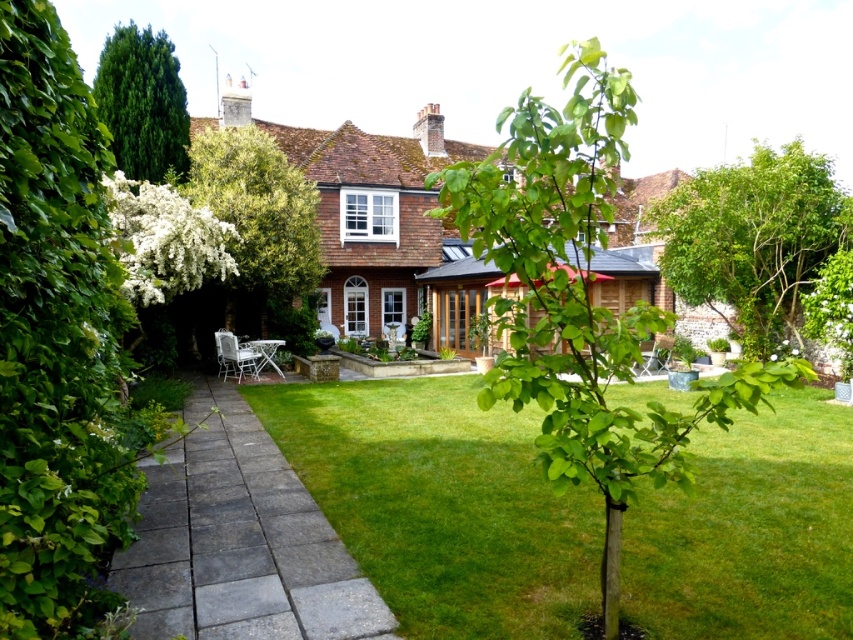
You are planning to install a bird feeder in this garden. The bird feeder requires a support structure that must be placed under a taller object to avoid direct sunlight. Which object between the green leafy hedge at left and the white textured tree at center should you choose?

The green leafy hedge at left is much taller than the white textured tree at center, so you should place the bird feeder support under the green leafy hedge at left to ensure it is shaded from direct sunlight.

You are standing at the entrance of the garden and want to reach the red awning on the patio. The green leafy hedge at left is located at point (57, 342). Which direction should you move to avoid the green leafy hedge at left and head towards the red awning?

Since the green leafy hedge at left is located at point (57, 342), you should move to the right to avoid it and head towards the red awning.